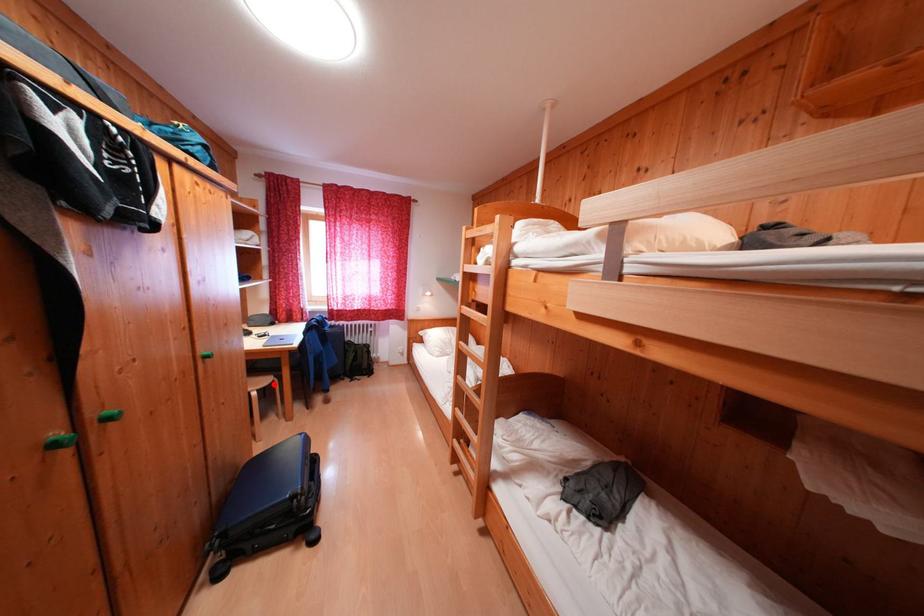
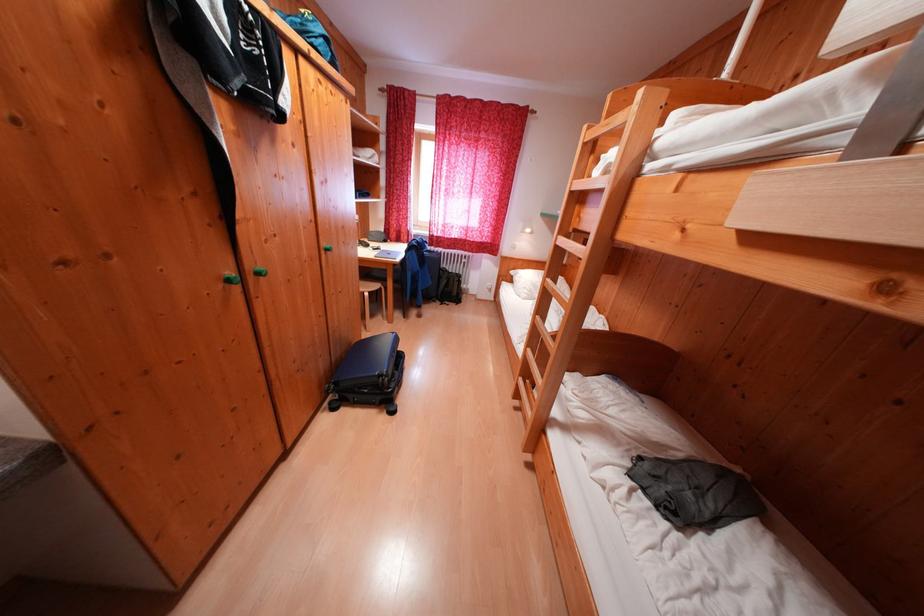
Question: A red point is marked in image1. In image2, is the corresponding 3D point closer to the camera or farther? Reply with the corresponding letter.

Choices:
 (A) The corresponding 3D point is closer.
 (B) The corresponding 3D point is farther.

Answer: (A)